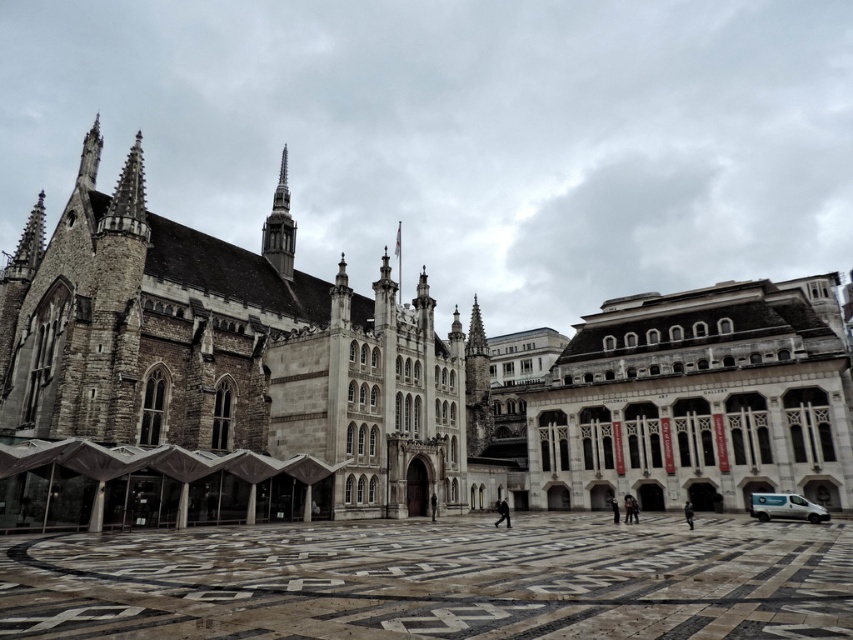
You are standing in front of the stone church at center and want to take a photo of the silver spire at center. Since the spire is part of the church, will you have to move closer or farther away to focus on just the spire in your shot?

The stone church at center is closer to the viewer than the silver spire at center. To focus on the silver spire at center, you would need to move farther away so that the spire fills the frame without the church blocking it.

You are a visitor standing in front of the stone church at center and the marble floor at center. Which object is taller?

The stone church at center is much taller than the marble floor at center.

You are standing in front of the stone church at center and want to look up at the silver spire at center. In which direction should you move your gaze?

The stone church at center is located below the silver spire at center, so you should look upward to see the silver spire at center.